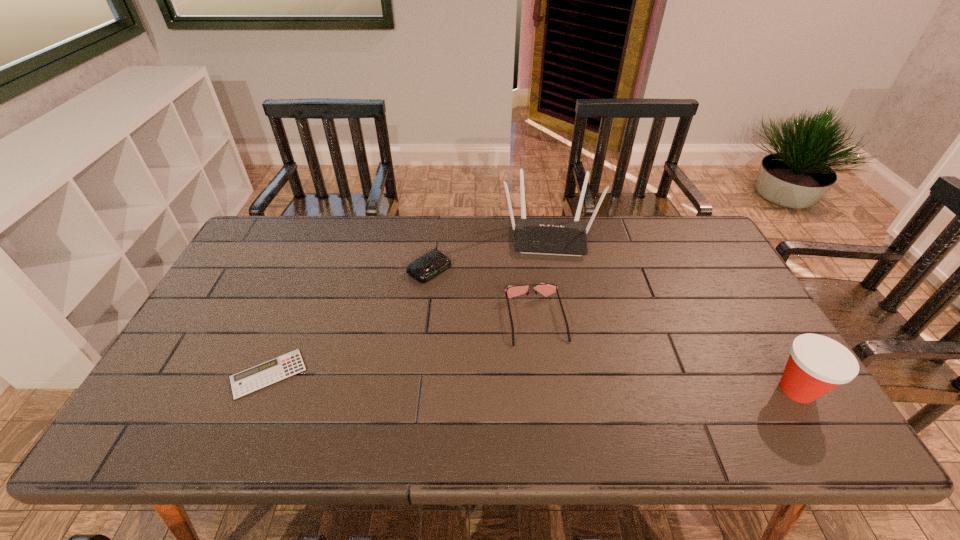
Locate an element on the screen. the shortest object is located at coordinates (252, 379).

I want to click on the leftmost object, so click(252, 379).

Find the location of `the fourth shortest object`. the fourth shortest object is located at coordinates (817, 364).

Identify the location of Dixie cup. The image size is (960, 540). (817, 364).

Locate an element on the screen. This screenshot has height=540, width=960. alarm clock is located at coordinates (433, 263).

Identify the location of the fourth tallest object. (433, 263).

Locate an element on the screen. The image size is (960, 540). the third shortest object is located at coordinates (545, 289).

Locate an element on the screen. Image resolution: width=960 pixels, height=540 pixels. the third farthest object is located at coordinates (545, 289).

You are a GUI agent. You are given a task and a screenshot of the screen. Output one action in this format:
    pyautogui.click(x=<x>, y=<y>)
    Task: Click on the tallest object
    
    Given the screenshot: What is the action you would take?
    pyautogui.click(x=533, y=236)

In order to click on free space located on the left of the calculator in this screenshot , I will do `click(203, 374)`.